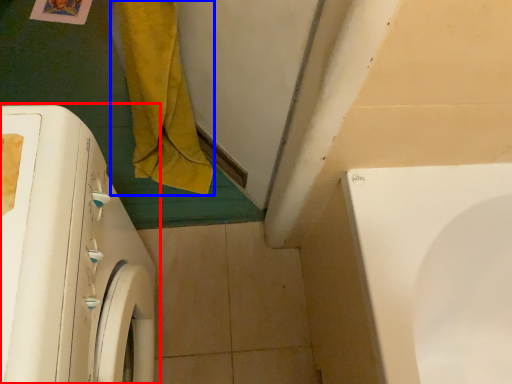
Question: Which object appears closest to the camera in this image, washing machine (highlighted by a red box) or bath towel (highlighted by a blue box)?

Choices:
 (A) washing machine
 (B) bath towel

Answer: (A)